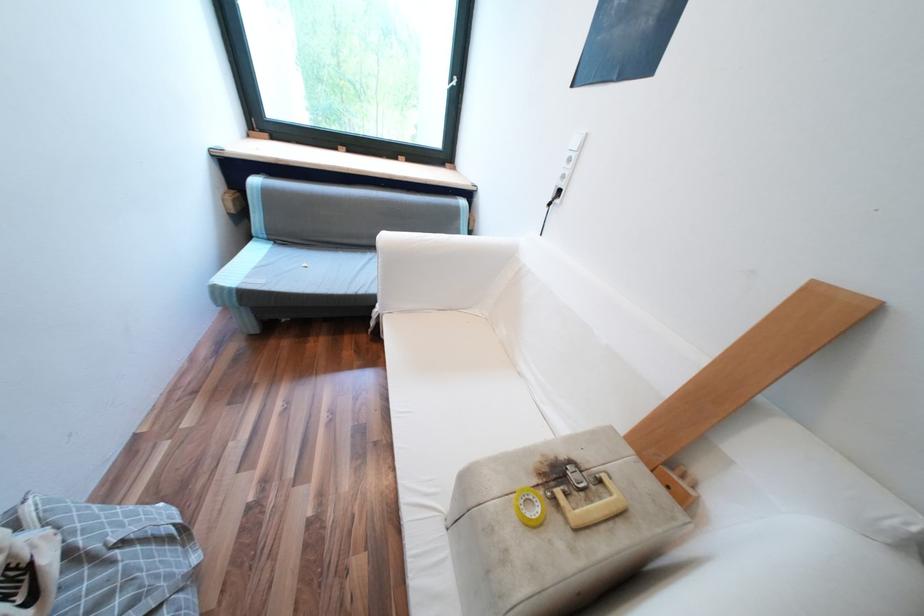
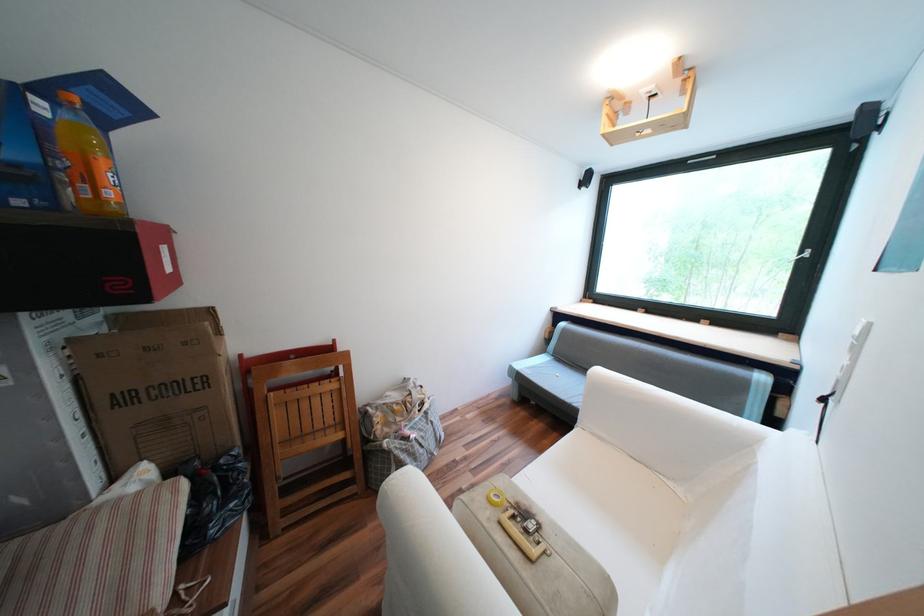
In the second image, find the point that corresponds to (x=459, y=79) in the first image.

(809, 253)